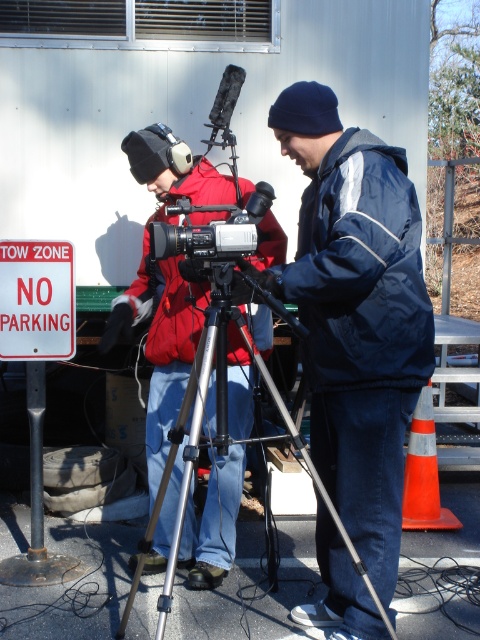
Question: Which point is closer to the camera?

Choices:
 (A) silver metallic tripod at center
 (B) white plastic sign at left

Answer: (A)

Question: Which point is closer to the camera taking this photo?

Choices:
 (A) (203, 397)
 (B) (60, 273)
 (C) (384, 452)

Answer: (A)

Question: Which point is farther to the camera?

Choices:
 (A) (356, 236)
 (B) (286, 419)
 (C) (215, 225)
 (D) (9, 323)

Answer: (D)

Question: Does dark blue jacket at center come in front of silver metallic video camera at center?

Choices:
 (A) no
 (B) yes

Answer: (B)

Question: Does dark blue jacket at center appear on the right side of white plastic sign at left?

Choices:
 (A) no
 (B) yes

Answer: (B)

Question: Is dark blue jacket at center to the right of white plastic sign at left from the viewer's perspective?

Choices:
 (A) yes
 (B) no

Answer: (A)